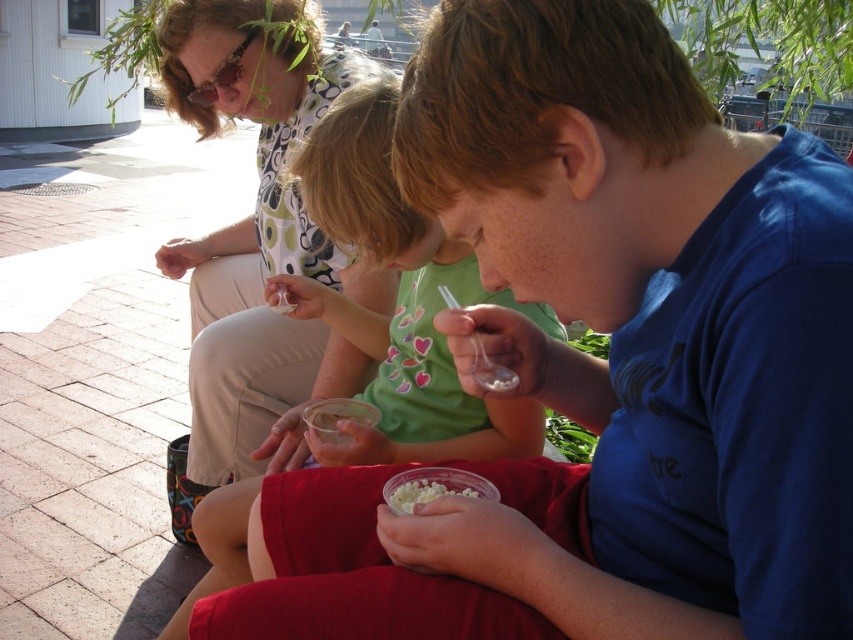
Is matte floral shirt at upper center positioned behind white creamy popcorn at lower center?

Yes.

Does point (274, 140) come behind point (404, 493)?

Yes, point (274, 140) is behind point (404, 493).

Where is `matte floral shirt at upper center`? The image size is (853, 640). matte floral shirt at upper center is located at coordinates (256, 244).

Is green matte shirt at center positioned in front of white creamy popcorn at lower center?

That is False.

Is green matte shirt at center to the right of white creamy popcorn at lower center from the viewer's perspective?

No, green matte shirt at center is not to the right of white creamy popcorn at lower center.

Is point (433, 349) behind point (425, 499)?

Yes, point (433, 349) is behind point (425, 499).

I want to click on green matte shirt at center, so click(399, 298).

Is point (247, 106) in front of point (498, 435)?

No, (247, 106) is further to viewer.

Is point (229, 317) behind point (399, 252)?

Yes, point (229, 317) is behind point (399, 252).

You are a GUI agent. You are given a task and a screenshot of the screen. Output one action in this format:
    pyautogui.click(x=<x>, y=<y>)
    Task: Click on the matte floral shirt at upper center
    Image resolution: width=853 pixels, height=640 pixels.
    Given the screenshot: What is the action you would take?
    pyautogui.click(x=256, y=244)